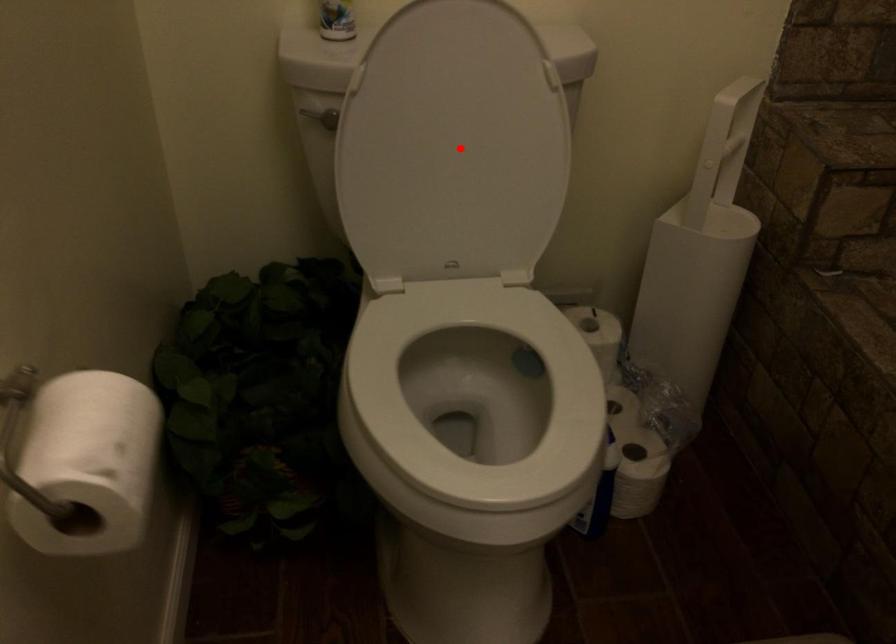
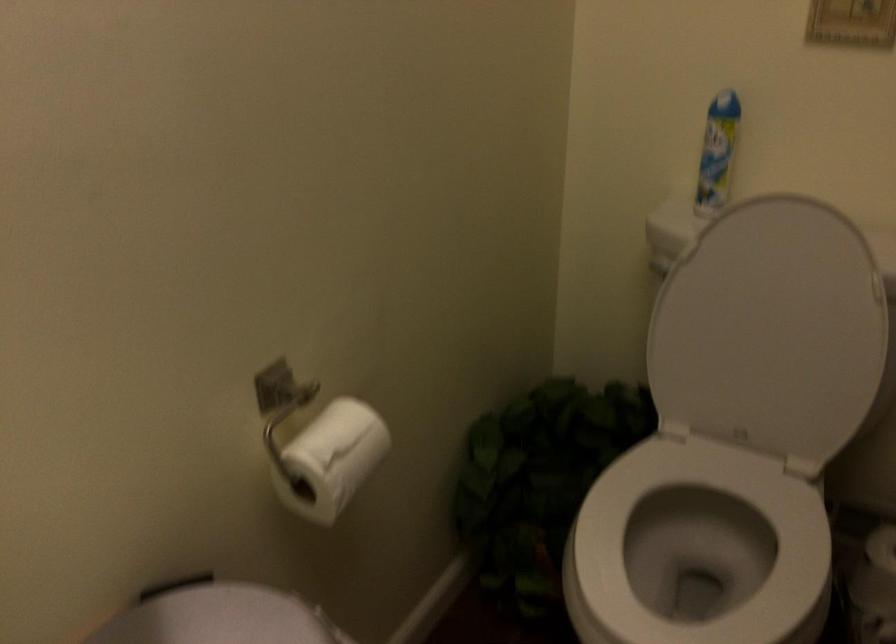
Locate, in the second image, the point that corresponds to the highlighted location in the first image.

(771, 330)